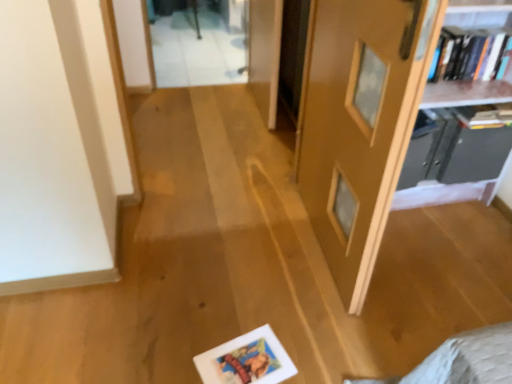
Where is `free space in front of wooden bookshelf at upper right, arranged as the first shelf when viewed from the top`? Image resolution: width=512 pixels, height=384 pixels. free space in front of wooden bookshelf at upper right, arranged as the first shelf when viewed from the top is located at coordinates (443, 258).